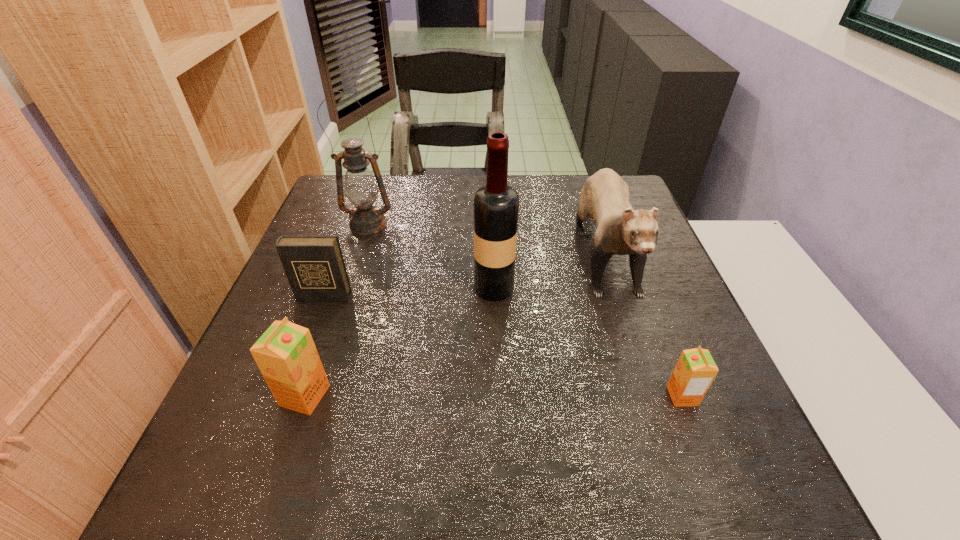
Where is `vacant space located on the face of the ferret`? vacant space located on the face of the ferret is located at coordinates (651, 390).

Find the location of a particular element. vacant space situated on the front cover of the second shortest object is located at coordinates (311, 329).

Identify the location of vacant point located 0.260m on the right of the oil lamp. (490, 224).

Where is `ferret that is at the far edge`? The height and width of the screenshot is (540, 960). ferret that is at the far edge is located at coordinates [x=620, y=230].

I want to click on oil lamp located in the far edge section of the desktop, so tap(361, 189).

Find the location of a particular element. The height and width of the screenshot is (540, 960). orange juice present at the left edge is located at coordinates (286, 355).

This screenshot has width=960, height=540. I want to click on diary that is positioned at the left edge, so click(314, 265).

Identify the location of oil lamp present at the left edge. This screenshot has width=960, height=540. (361, 189).

This screenshot has height=540, width=960. I want to click on orange juice positioned at the right edge, so click(x=695, y=370).

Locate an element on the screen. The height and width of the screenshot is (540, 960). ferret that is at the right edge is located at coordinates (620, 230).